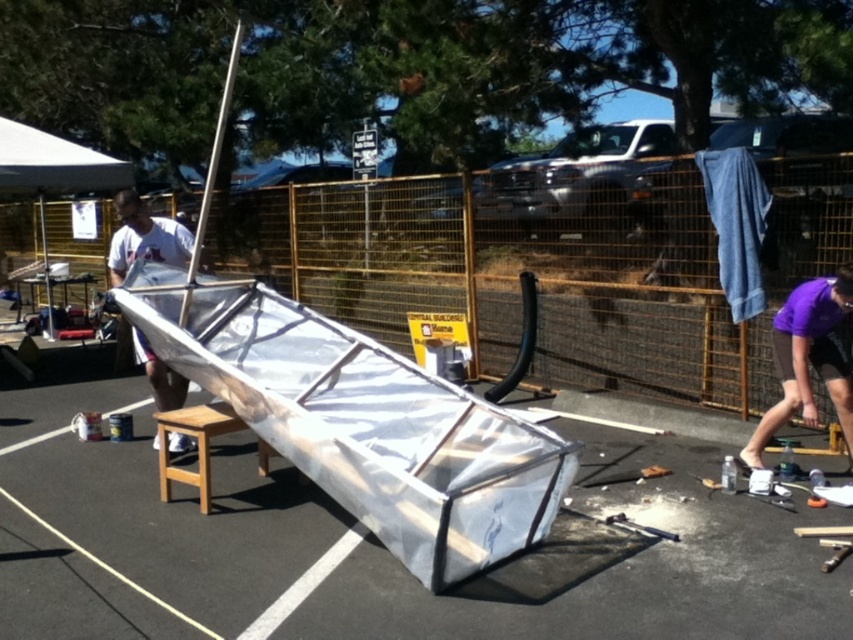
You are standing in the parking lot and want to place a new bench between the white fabric sailboat at left and the white fabric canopy at upper left. Based on their positions, which object should the bench be closer to?

The bench should be placed closer to the white fabric sailboat at left because it is located below the white fabric canopy at upper left, meaning the sailboat is lower in position and the canopy is above it. Since the bench is already near the structure, placing it closer to the sailboat maintains proximity to the lower structure.

You are a delivery person trying to bring a large package to the transparent plastic ramp at center. There is a purple fabric at lower right nearby. Can you pass through the space between them?

The transparent plastic ramp at center might be wider than purple fabric at lower right, so it is uncertain if the space between them is wide enough for the delivery person and the large package to pass through safely.

You are an observer standing in front of the structure. You see the transparent plastic ramp at center and the purple fabric at lower right. Which object is located above the other?

The purple fabric at lower right is above the transparent plastic ramp at center because the transparent plastic ramp at center is positioned under it.